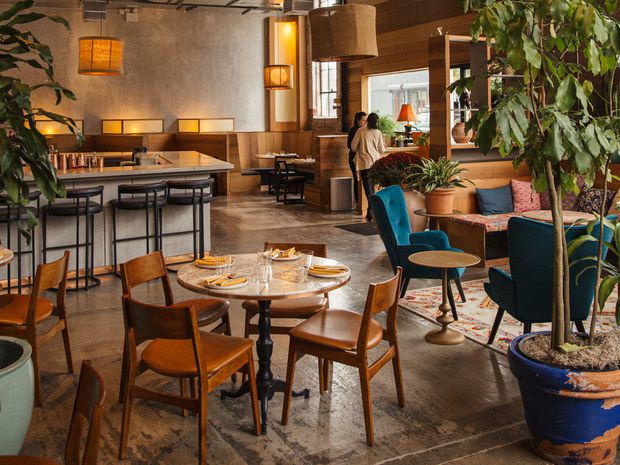
Where is `plates`? Image resolution: width=620 pixels, height=465 pixels. plates is located at coordinates (x=208, y=258), (x=219, y=281), (x=321, y=270), (x=285, y=253).